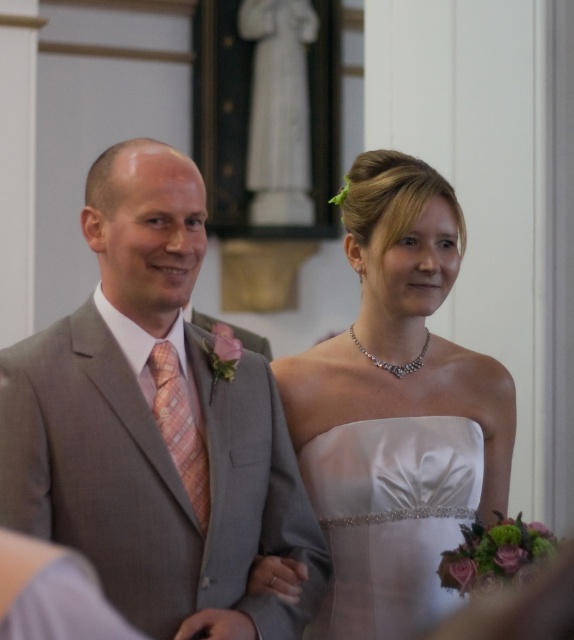
You are a photographer at a wedding and need to position the couple so that the white satin dress at center and the satin white dress at center are both visible in the frame. Which dress should you focus on to ensure the larger one is highlighted?

The white satin dress at center is larger than the satin white dress at center, so focusing on it will highlight the larger dress.